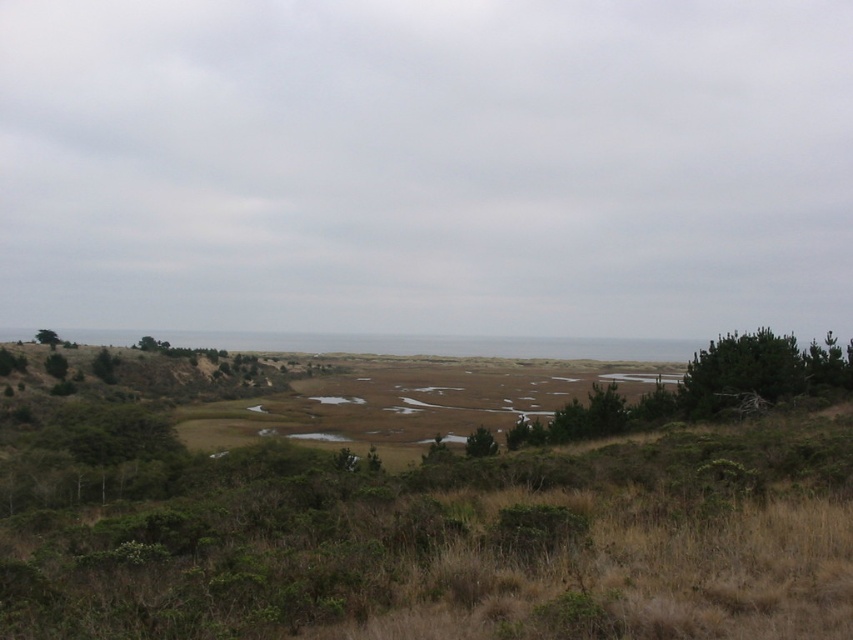
Question: Which object is the closest to the green matte tree at upper left?

Choices:
 (A) green matte tree at center
 (B) green matte tree at right

Answer: (A)

Question: Estimate the real-world distances between objects in this image. Which object is farther from the green matte tree at right?

Choices:
 (A) green matte tree at center
 (B) green matte tree at upper left

Answer: (B)

Question: Considering the relative positions of green matte tree at right and green matte tree at center in the image provided, where is green matte tree at right located with respect to green matte tree at center?

Choices:
 (A) below
 (B) above

Answer: (B)

Question: Is green matte tree at right closer to the viewer compared to green matte tree at center?

Choices:
 (A) yes
 (B) no

Answer: (B)

Question: Is green matte tree at right bigger than green matte tree at center?

Choices:
 (A) no
 (B) yes

Answer: (A)

Question: Which point is closer to the camera?

Choices:
 (A) green matte tree at right
 (B) green matte tree at center

Answer: (B)